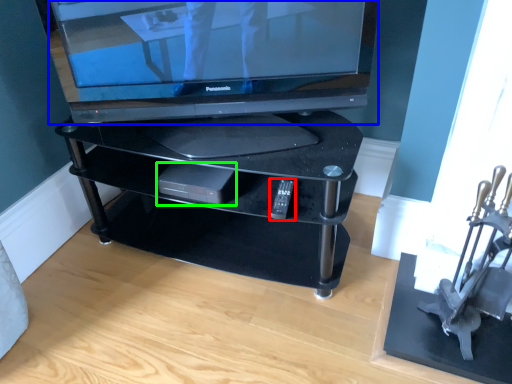
Question: Based on their relative distances, which object is farther from remote (highlighted by a red box)? Choose from television (highlighted by a blue box) and gadget (highlighted by a green box).

Choices:
 (A) television
 (B) gadget

Answer: (A)